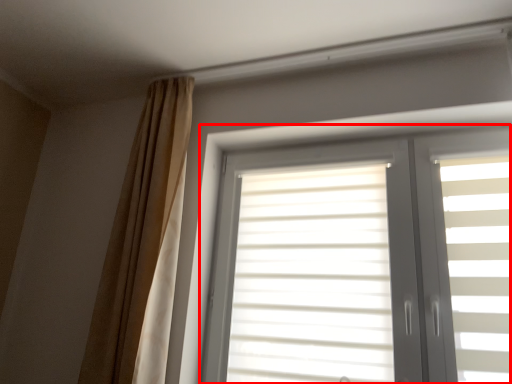
Question: From the image, what is the correct spatial relationship of window (annotated by the red box) in relation to curtain?

Choices:
 (A) right
 (B) left

Answer: (A)